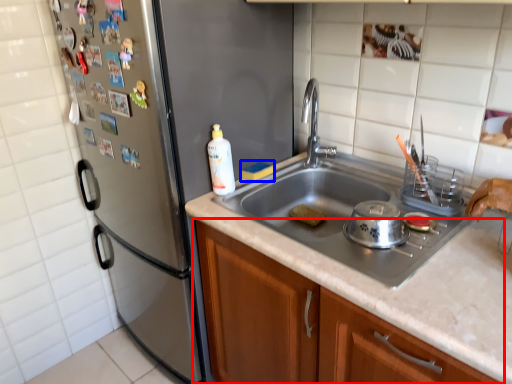
Question: Which point is further to the camera, cabinetry (highlighted by a red box) or food (highlighted by a blue box)?

Choices:
 (A) cabinetry
 (B) food

Answer: (B)